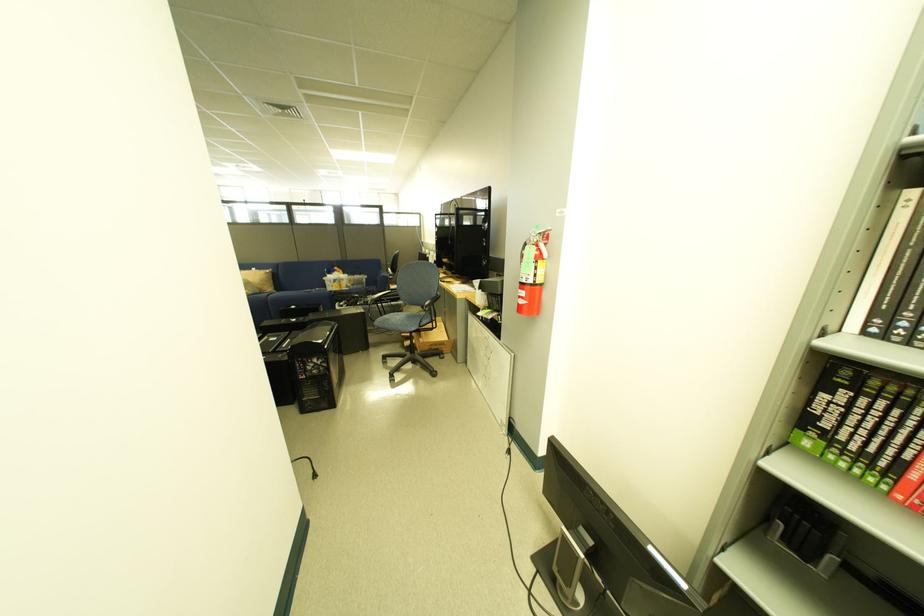
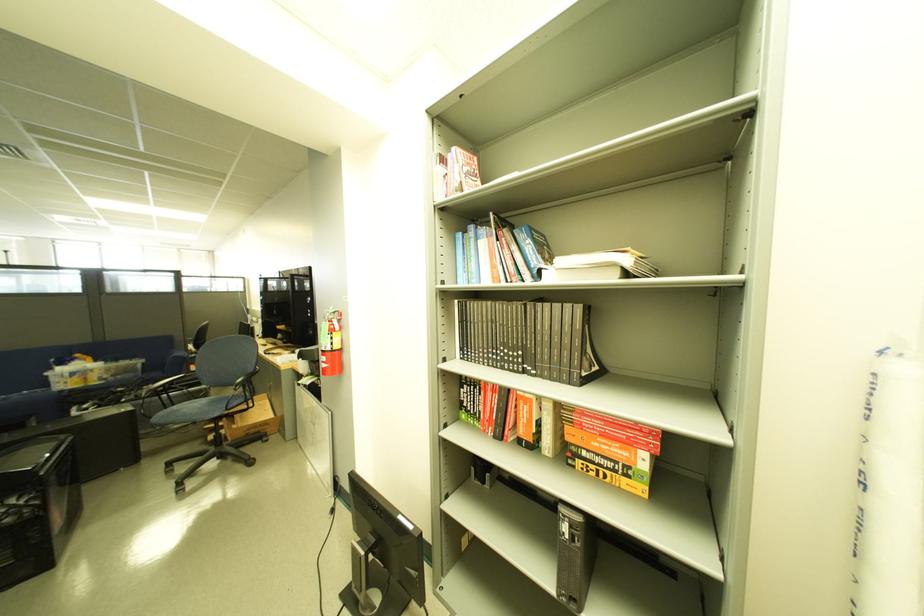
Find the pixel in the second image that matches the point at 396,315 in the first image.

(185, 408)